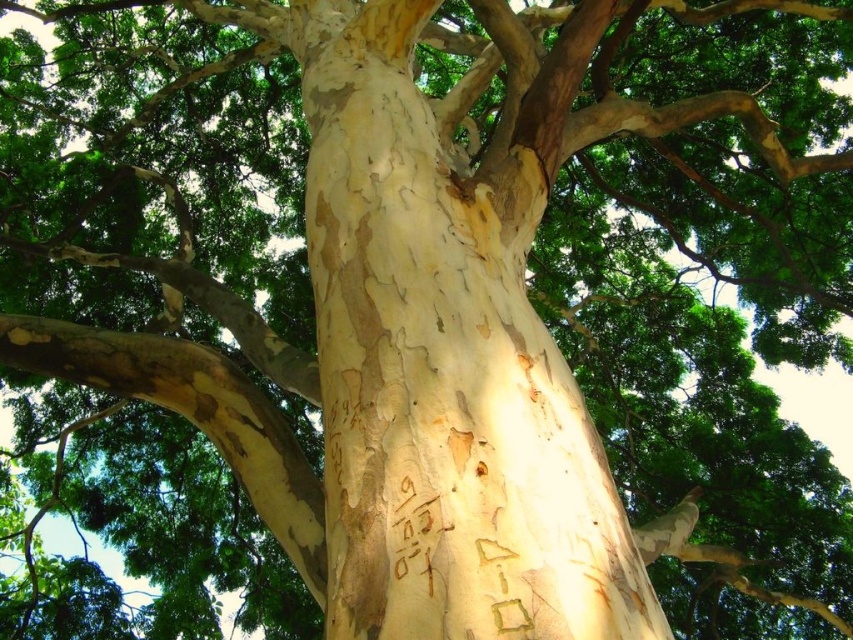
Between white textured bark at center and brown rough bark at center, which one has less height?

Standing shorter between the two is brown rough bark at center.

Does white textured bark at center appear over brown rough bark at center?

Correct, white textured bark at center is located above brown rough bark at center.

This screenshot has width=853, height=640. What do you see at coordinates (450, 355) in the screenshot? I see `white textured bark at center` at bounding box center [450, 355].

This screenshot has height=640, width=853. Find the location of `white textured bark at center`. white textured bark at center is located at coordinates tap(450, 355).